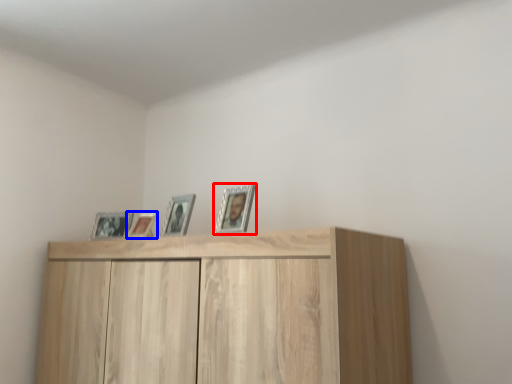
Question: Which object is closer to the camera taking this photo, picture frame (highlighted by a red box) or picture frame (highlighted by a blue box)?

Choices:
 (A) picture frame
 (B) picture frame

Answer: (A)